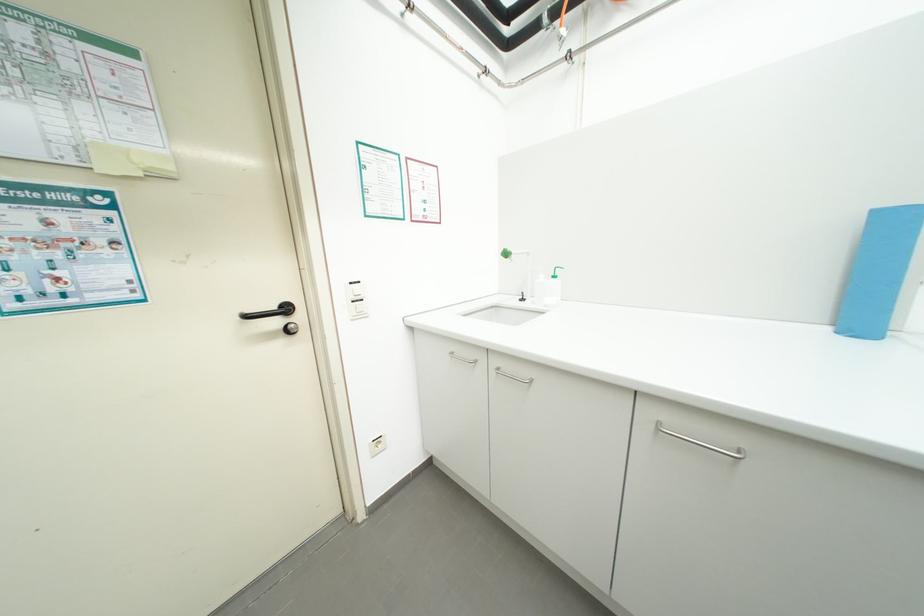
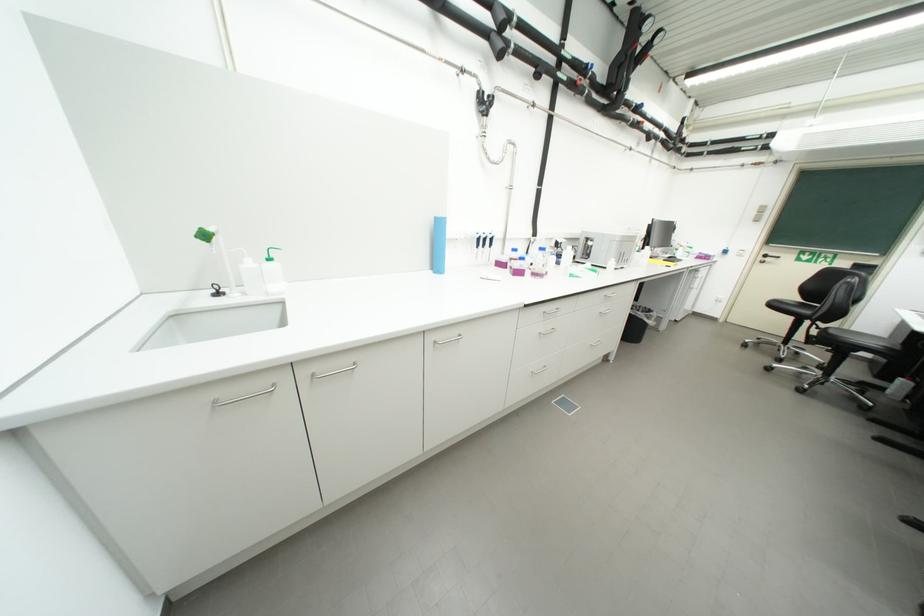
The point at (x=835, y=330) is marked in the first image. Where is the corresponding point in the second image?

(439, 273)